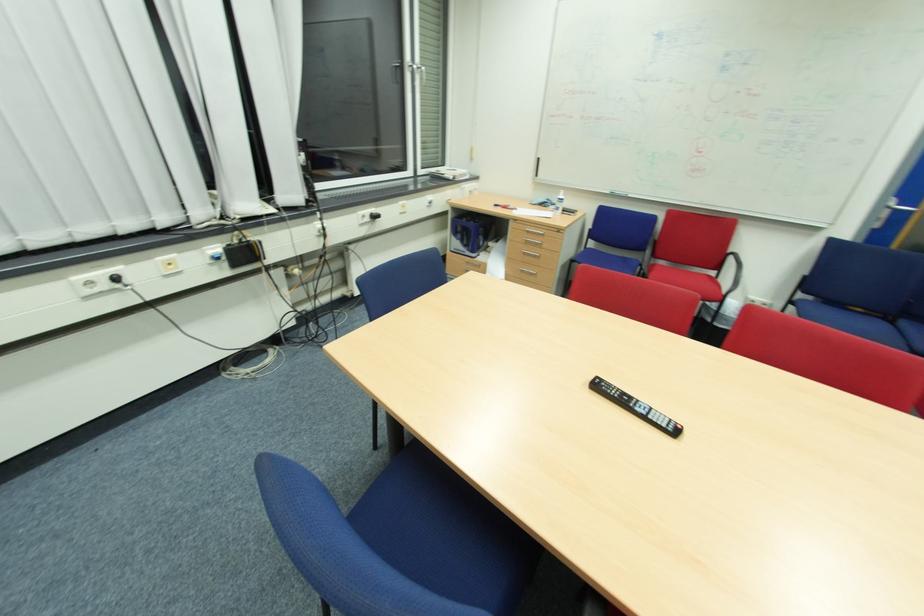
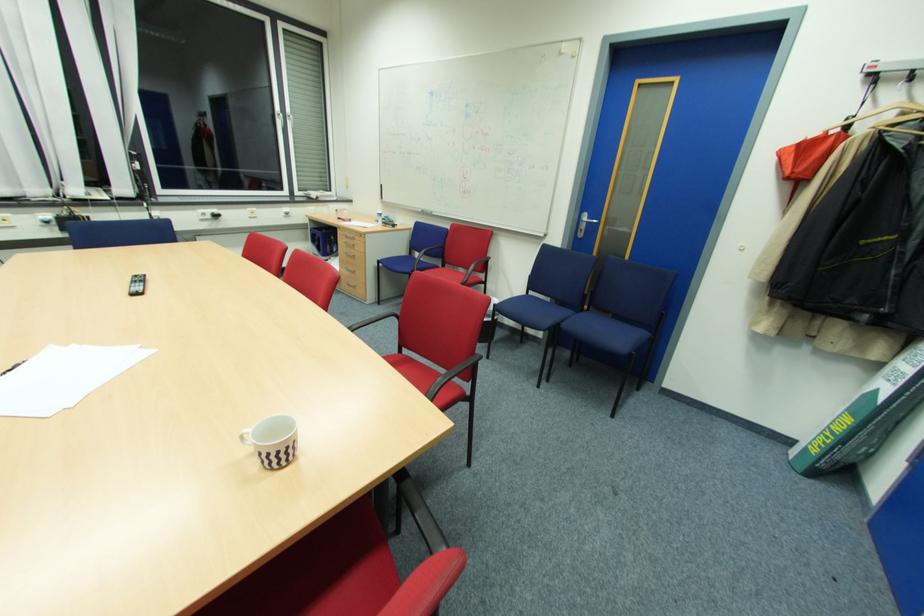
In the second image, find the point that corresponds to (x=380, y=217) in the first image.

(220, 216)